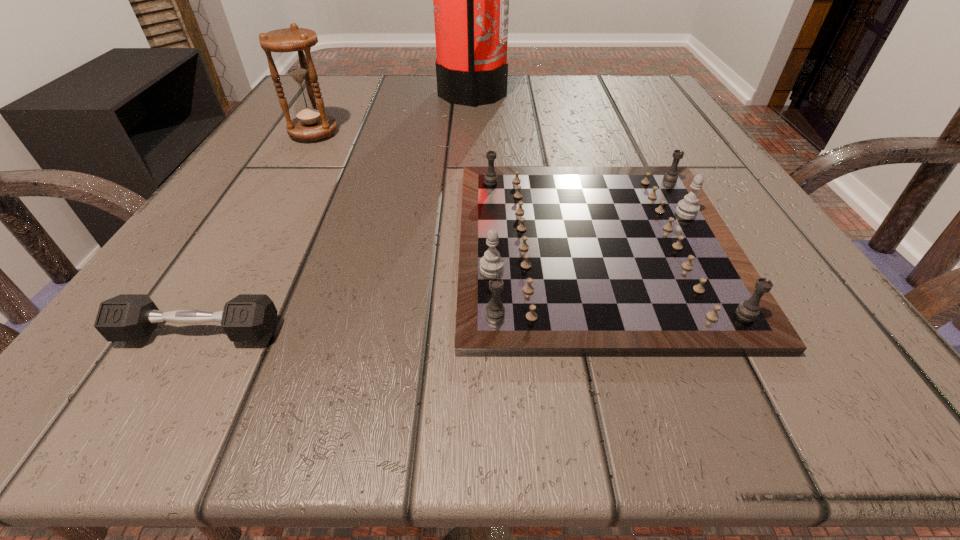
Locate an element on the screen. The height and width of the screenshot is (540, 960). the farthest object is located at coordinates (471, 0).

This screenshot has height=540, width=960. I want to click on fire extinguisher, so click(x=471, y=0).

I want to click on the second farthest object, so click(x=294, y=44).

Locate an element on the screen. The width and height of the screenshot is (960, 540). hourglass is located at coordinates (294, 44).

The width and height of the screenshot is (960, 540). In order to click on the third tallest object in this screenshot , I will do `click(554, 261)`.

Where is `the shortest object`? This screenshot has height=540, width=960. the shortest object is located at coordinates (127, 317).

Locate an element on the screen. free region located on the front side of the farthest object is located at coordinates pyautogui.click(x=560, y=94).

In order to click on free spot located on the right of the third shortest object in this screenshot , I will do `click(455, 133)`.

Find the location of a particular element. The width and height of the screenshot is (960, 540). vacant space located 0.240m on the board of the second shortest object is located at coordinates (274, 246).

The image size is (960, 540). What are the coordinates of `vacant space located 0.230m on the board of the second shortest object` in the screenshot? It's located at (281, 246).